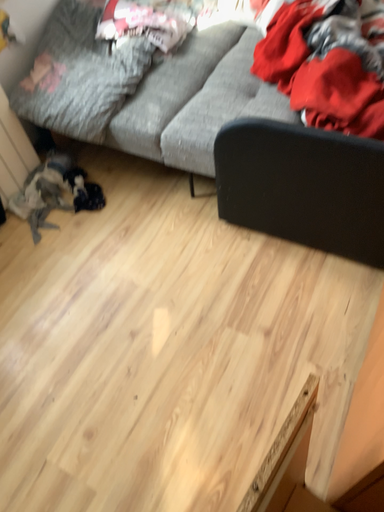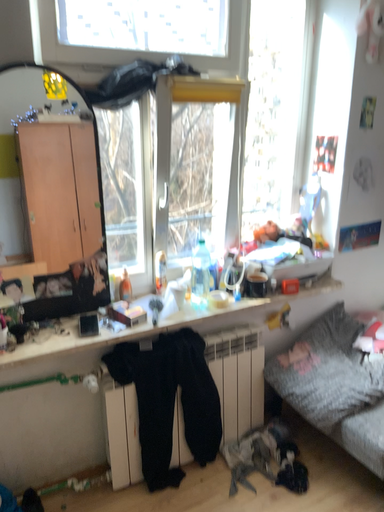
Question: Which way did the camera rotate in the video?

Choices:
 (A) rotated left
 (B) rotated right

Answer: (A)